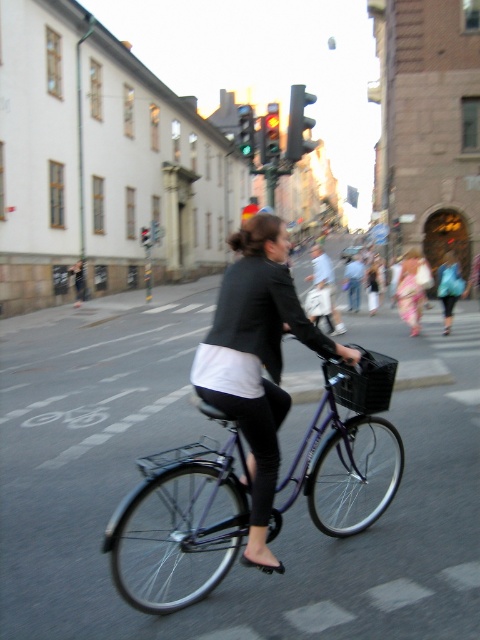
Based on the photo, is metallic purple bicycle at center shorter than floral fabric dress at center?

No.

Between metallic purple bicycle at center and floral fabric dress at center, which one is positioned higher?

Positioned higher is floral fabric dress at center.

Locate an element on the screen. metallic purple bicycle at center is located at coordinates (179, 524).

This screenshot has height=640, width=480. Identify the location of metallic purple bicycle at center. (179, 524).

Who is more distant from viewer, (294,150) or (251,156)?

The point (251,156) is more distant.

Image resolution: width=480 pixels, height=640 pixels. I want to click on black plastic traffic light at upper center, so click(x=299, y=124).

Does point (292, 152) come in front of point (238, 140)?

That is True.

In order to click on black plastic traffic light at upper center in this screenshot , I will do `click(299, 124)`.

Does black plastic traffic light at upper center appear on the right side of glassy red traffic light at upper center?

Indeed, black plastic traffic light at upper center is positioned on the right side of glassy red traffic light at upper center.

Is black plastic traffic light at upper center thinner than glassy red traffic light at upper center?

No.

Is point (295, 109) positioned before point (146, 240)?

Yes, point (295, 109) is in front of point (146, 240).

Image resolution: width=480 pixels, height=640 pixels. Identify the location of black plastic traffic light at upper center. (299, 124).